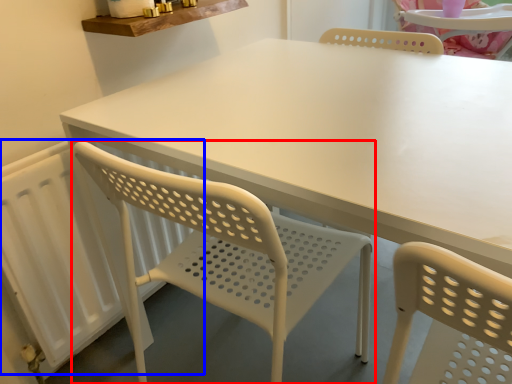
Question: Which point is further to the camera, chair (highlighted by a red box) or radiator (highlighted by a blue box)?

Choices:
 (A) chair
 (B) radiator

Answer: (B)